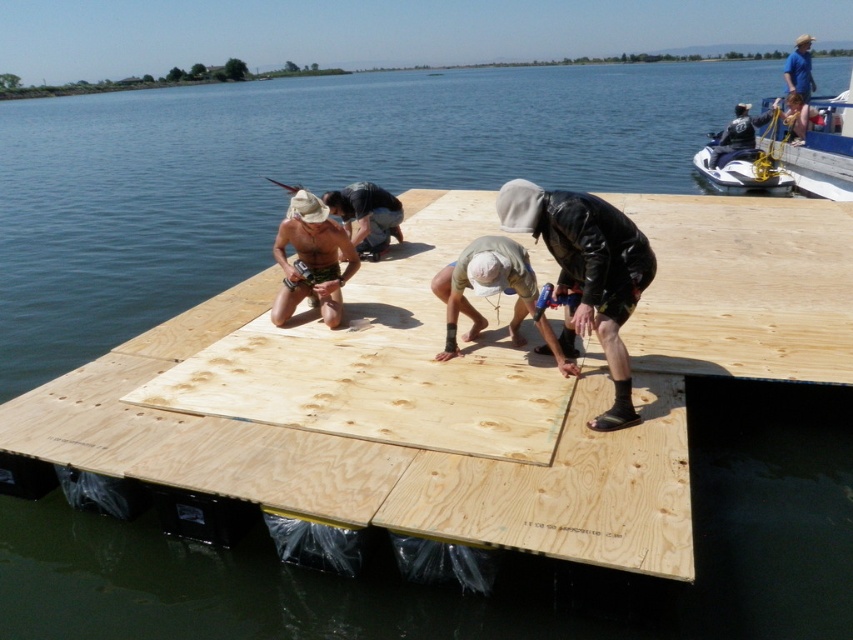
Which is behind, point (746, 104) or point (804, 35)?

Point (804, 35)

At what (x,y) coordinates should I click in order to perform the action: click on dark blue wetsuit at upper right. Please return your answer as a coordinate pair (x, y). Looking at the image, I should click on (740, 131).

The image size is (853, 640). Find the location of `dark blue wetsuit at upper right`. dark blue wetsuit at upper right is located at coordinates (740, 131).

Which is above, tan skin shirtless man at center or dark blue wetsuit at upper right?

dark blue wetsuit at upper right is higher up.

Describe the element at coordinates (311, 259) in the screenshot. I see `tan skin shirtless man at center` at that location.

Identify the location of tan skin shirtless man at center. The image size is (853, 640). (311, 259).

Which is below, matte black shirt at center or dark blue wetsuit at upper right?

Positioned lower is matte black shirt at center.

Does matte black shirt at center lie in front of dark blue wetsuit at upper right?

Yes, it is in front of dark blue wetsuit at upper right.

Where is `matte black shirt at center`? matte black shirt at center is located at coordinates (366, 216).